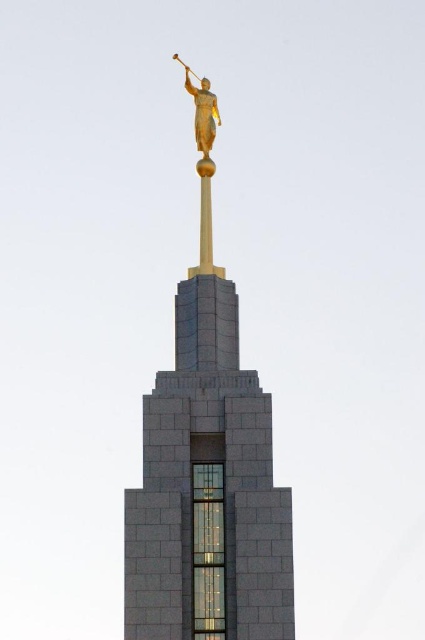
Question: In this image, where is gold polished statue at upper center located relative to gold polished statue at top?

Choices:
 (A) right
 (B) left

Answer: (A)

Question: Among these objects, which one is farthest from the camera?

Choices:
 (A) gold polished statue at upper center
 (B) gold polished statue at top

Answer: (B)

Question: Which point appears closest to the camera in this image?

Choices:
 (A) (206, 129)
 (B) (231, 637)

Answer: (B)

Question: Is gold polished statue at upper center positioned at the back of gold polished statue at top?

Choices:
 (A) no
 (B) yes

Answer: (A)

Question: Does gold polished statue at upper center have a smaller size compared to gold polished statue at top?

Choices:
 (A) no
 (B) yes

Answer: (A)

Question: Which point appears closest to the camera in this image?

Choices:
 (A) (201, 609)
 (B) (207, 100)

Answer: (A)